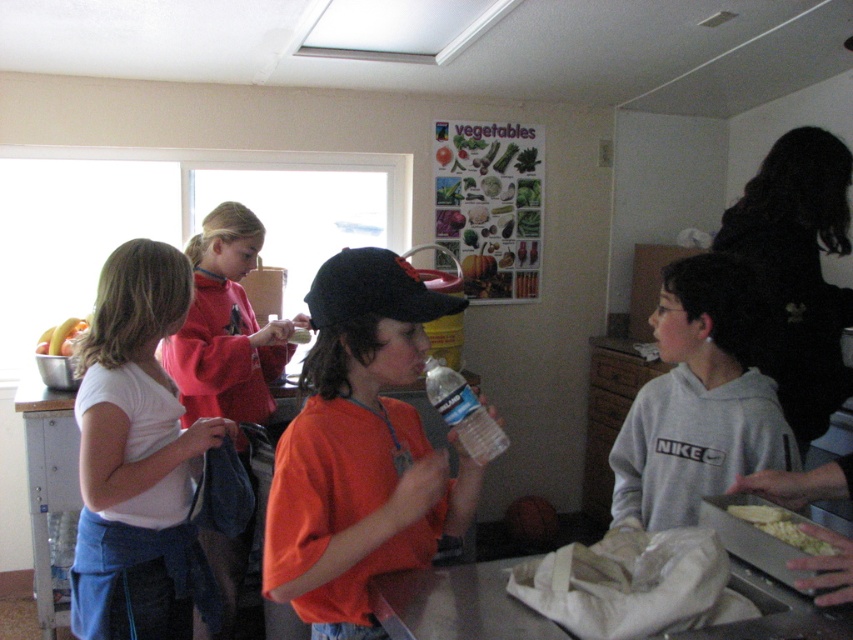
Looking at this image, you are a child in the scene holding a gray fleece hoodie at right and a black fabric at right. You want to place them on the table so they don

The gray fleece hoodie at right is 16.46 inches away from the black fabric at right, so you can place them on the table with that distance between them.

You are standing in the room and want to reach the point at coordinates (724, 458). If your height is 1.65 meters, can you comfortably reach that point without stretching?

The point at coordinates (724, 458) is 1.70 meters away from the viewer. Since your height is 1.65 meters, you would need to stretch slightly to reach it.